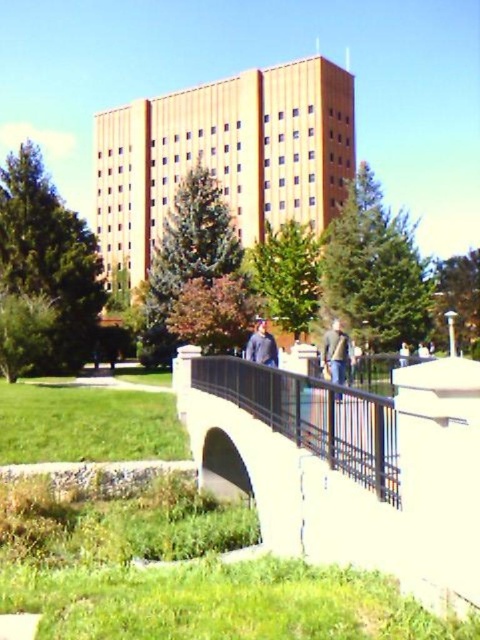
Is point (178, 358) closer to viewer compared to point (346, 358)?

No, it is behind (346, 358).

Is point (384, 563) closer to viewer compared to point (343, 336)?

Yes, it is in front of point (343, 336).

Locate an element on the screen. white concrete pedestrian bridge at center is located at coordinates (348, 467).

Can you confirm if denim jacket at right is positioned to the right of denim jacket at center?

Indeed, denim jacket at right is positioned on the right side of denim jacket at center.

Can you confirm if denim jacket at right is positioned below denim jacket at center?

Yes, denim jacket at right is below denim jacket at center.

Is point (340, 364) less distant than point (252, 356)?

That is False.

Find the location of a particular element. Image resolution: width=480 pixels, height=640 pixels. denim jacket at right is located at coordinates (336, 353).

Which is in front, point (344, 502) or point (256, 356)?

Point (344, 502) is more forward.

Is white concrete pedestrian bridge at center smaller than denim jacket at center?

Actually, white concrete pedestrian bridge at center might be larger than denim jacket at center.

Who is more forward, (267,440) or (254,356)?

Positioned in front is point (267,440).

The height and width of the screenshot is (640, 480). Find the location of `white concrete pedestrian bridge at center`. white concrete pedestrian bridge at center is located at coordinates (348, 467).